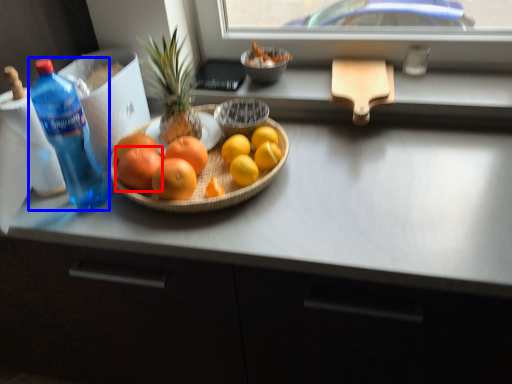
Question: Which object appears closest to the camera in this image, grapefruit (highlighted by a red box) or bottle (highlighted by a blue box)?

Choices:
 (A) grapefruit
 (B) bottle

Answer: (B)